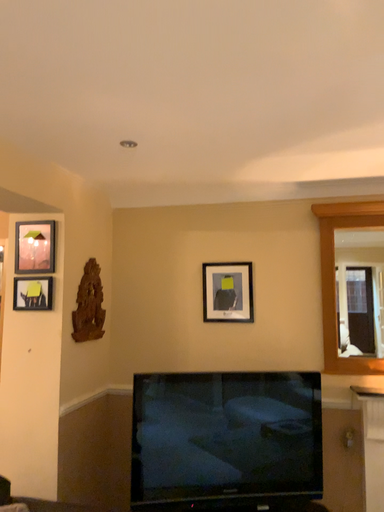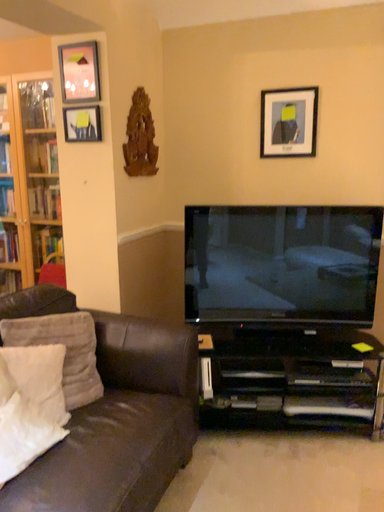
Question: Which way did the camera rotate in the video?

Choices:
 (A) rotated left
 (B) rotated right

Answer: (A)